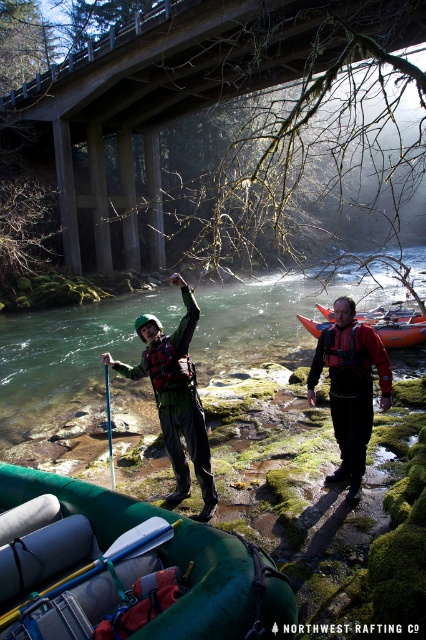
Question: Which object is closer to the camera taking this photo?

Choices:
 (A) blue plastic paddle at lower left
 (B) brushed metal life jacket at center
 (C) matte green jacket at center

Answer: (A)

Question: Can you confirm if concrete bridge at upper center is positioned to the right of orange rubber raft at center?

Choices:
 (A) no
 (B) yes

Answer: (A)

Question: Is blue plastic paddle at lower left in front of orange rubber raft at center?

Choices:
 (A) no
 (B) yes

Answer: (B)

Question: Is the position of concrete bridge at upper center less distant than that of blue plastic paddle at lower left?

Choices:
 (A) no
 (B) yes

Answer: (A)

Question: Based on their relative distances, which object is farther from the green rubber raft at center?

Choices:
 (A) matte green jacket at center
 (B) concrete bridge at upper center
 (C) red nylon life jacket at center
 (D) blue plastic paddle at lower left

Answer: (A)

Question: Among these objects, which one is nearest to the camera?

Choices:
 (A) matte green jacket at center
 (B) brushed metal life jacket at center

Answer: (A)